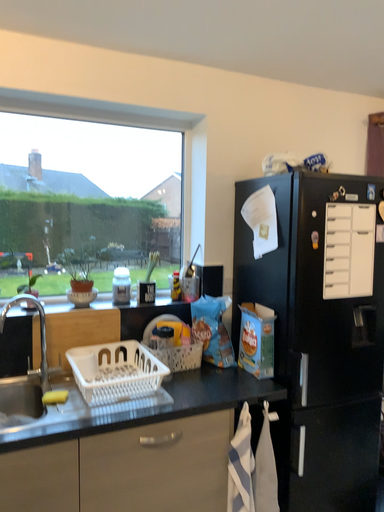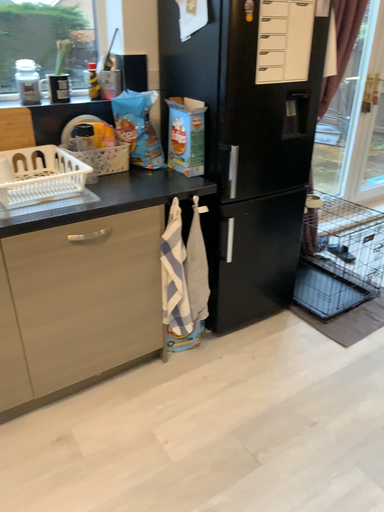
Question: How did the camera likely rotate when shooting the video?

Choices:
 (A) rotated right
 (B) rotated left

Answer: (A)